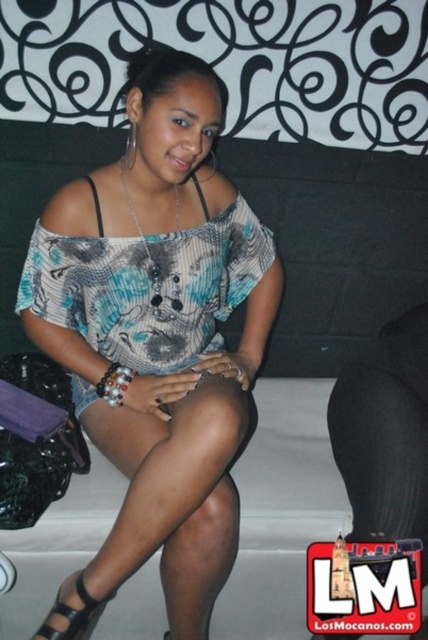
Is point (232, 227) positioned behind point (83, 568)?

Yes, point (232, 227) is farther from viewer.

Between point (48, 268) and point (76, 596), which one is positioned in front?

Point (76, 596)

At what (x,y) coordinates should I click in order to perform the action: click on printed fabric dress at center. Please return your answer as a coordinate pair (x, y). Image resolution: width=428 pixels, height=640 pixels. Looking at the image, I should click on (148, 285).

Does printed fabric blouse at center have a smaller size compared to printed fabric dress at center?

No, printed fabric blouse at center is not smaller than printed fabric dress at center.

The image size is (428, 640). What do you see at coordinates (158, 330) in the screenshot?
I see `printed fabric blouse at center` at bounding box center [158, 330].

Image resolution: width=428 pixels, height=640 pixels. I want to click on printed fabric blouse at center, so click(x=158, y=330).

Consider the image. Can you confirm if printed fabric blouse at center is positioned to the right of black leather sandal at lower left?

Correct, you'll find printed fabric blouse at center to the right of black leather sandal at lower left.

Is point (181, 540) positioned after point (68, 600)?

No, it is in front of (68, 600).

Identify the location of printed fabric blouse at center. The width and height of the screenshot is (428, 640). 158,330.